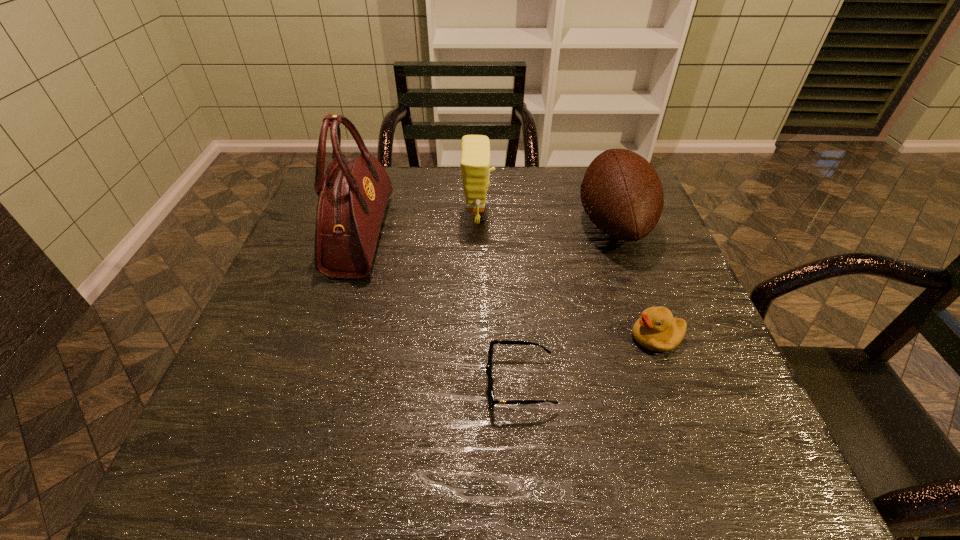
This screenshot has width=960, height=540. I want to click on free space between the sponge and the duckling, so click(x=567, y=277).

Where is `free spot between the tallest object and the sponge`? free spot between the tallest object and the sponge is located at coordinates point(420,226).

This screenshot has height=540, width=960. Identify the location of vacant space in between the sunglasses and the tallest object. (440, 309).

The width and height of the screenshot is (960, 540). Identify the location of free space between the leftmost object and the fourth tallest object. (509, 286).

Where is `free space between the shortest object and the tallest object`? The width and height of the screenshot is (960, 540). free space between the shortest object and the tallest object is located at coordinates (440, 309).

Locate an element on the screen. Image resolution: width=960 pixels, height=540 pixels. free space between the sunglasses and the football is located at coordinates (566, 303).

Locate an element on the screen. free space between the leftmost object and the sponge is located at coordinates (420, 226).

Image resolution: width=960 pixels, height=540 pixels. What are the coordinates of `vacant area between the handbag and the sponge` in the screenshot? It's located at (420, 226).

The image size is (960, 540). What are the coordinates of `vacant space that's between the shortest object and the fourth tallest object` in the screenshot? It's located at (588, 360).

Select which object appears as the second closest to the shortest object. Please provide its 2D coordinates. Your answer should be formatted as a tuple, i.e. [(x, y)], where the tuple contains the x and y coordinates of a point satisfying the conditions above.

[(622, 194)]